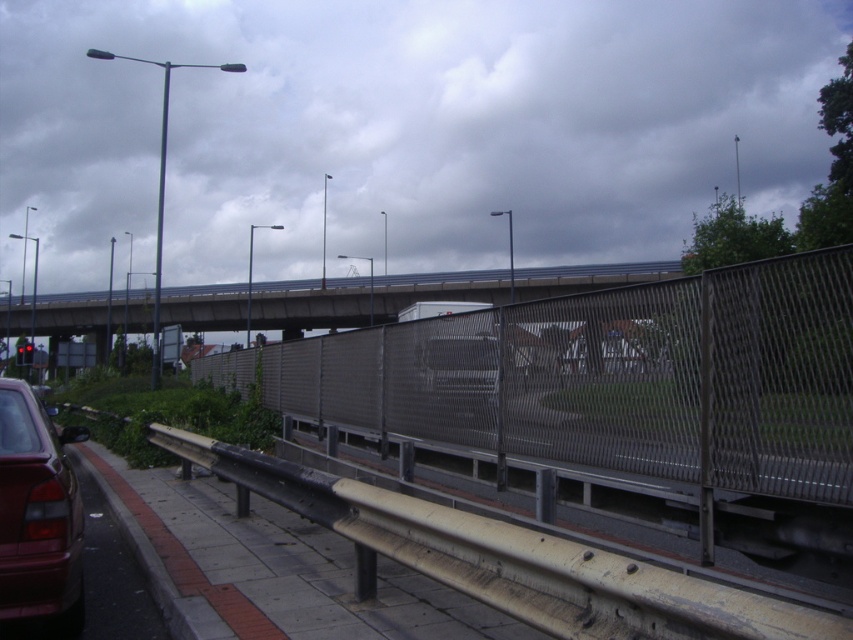
Looking at this image, you are a delivery drone operator. Your drone is currently hovering 3 meters above the ground. The drone has a maximum flight height of 5 meters. You need to fly the drone over the metal mesh fence at center. According to the image, can the drone safely pass over the fence without exceeding its height limit?

The metal mesh fence at center is 4.02 meters from camera. Since the drone is hovering 3 meters above the ground and the fence is 4.02 meters away, the drone can safely pass over the fence as its height remains within the 5 meters limit.

You are a delivery person carrying a large package that is 12 feet long. You need to walk along the sidewalk while avoiding obstacles. Can you safely pass through the area near the metal mesh fence at center without the package hitting the fence?

The metal mesh fence at center is 13.20 feet away from the viewer. Since the package is 12 feet long, it will not reach the fence when carried, so you can safely pass through the area near the metal mesh fence at center without the package hitting the fence.